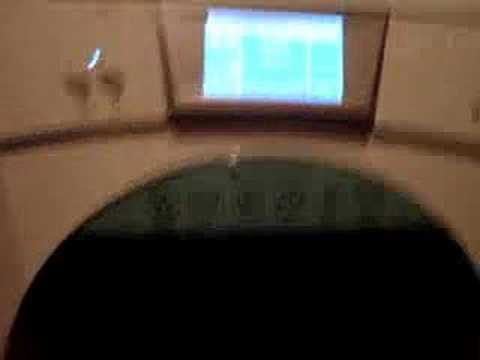
The width and height of the screenshot is (480, 360). I want to click on this could possibly be some sort of display panel, so click(278, 64).